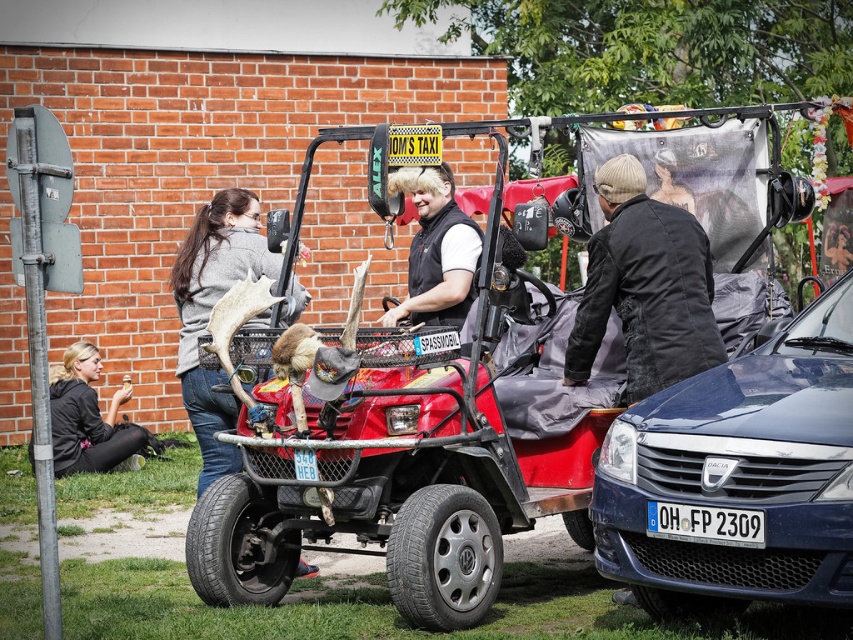
You are a delivery person needing to unload a package that requires a 8 feet wide space between the red matte jeep at center and the blue metallic car at lower right. Can you fit your delivery vehicle between them?

The red matte jeep at center is 7.04 feet from the blue metallic car at lower right, which is less than the required 8 feet. Therefore, the delivery vehicle cannot fit between them.

You are a passenger in the red matte jeep at center and want to exit the vehicle. The distressed black jacket at center is blocking your path. Can you move to the right to get out?

The red matte jeep at center is to the left of the distressed black jacket at center, so moving to the right would allow you to exit without obstruction from the jacket.

You are a parking attendant and need to park the red matte jeep at center and the blue metallic car at lower right in two adjacent spots. Given their widths, which vehicle should be placed in the wider parking spot?

The red matte jeep at center has a greater width than the blue metallic car at lower right, so it should be placed in the wider parking spot.